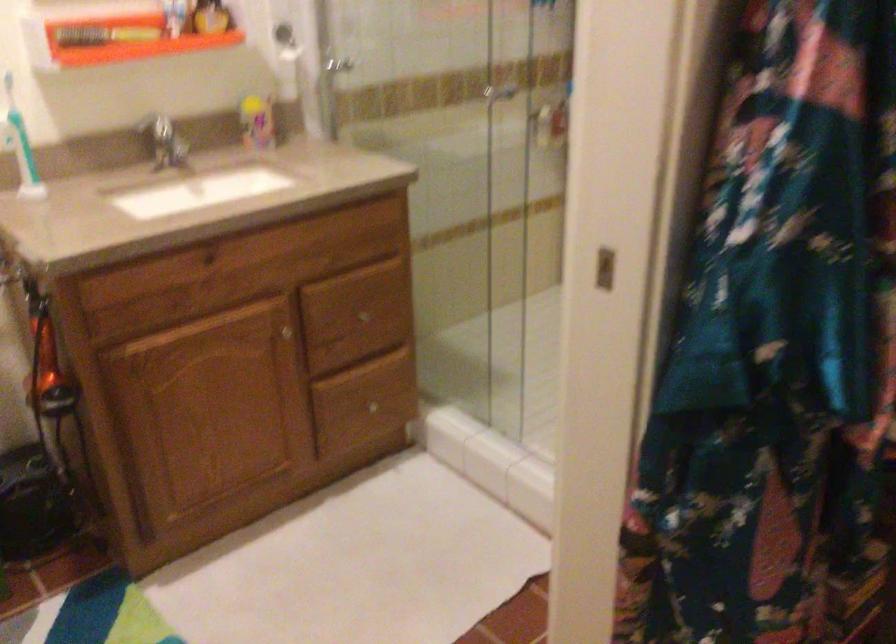
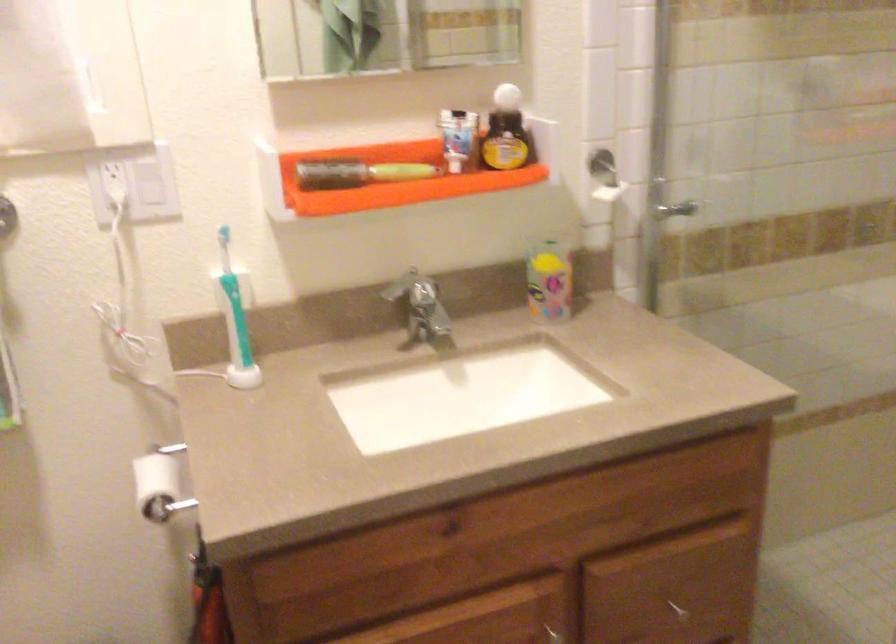
The point at (255, 118) is marked in the first image. Where is the corresponding point in the second image?

(549, 279)